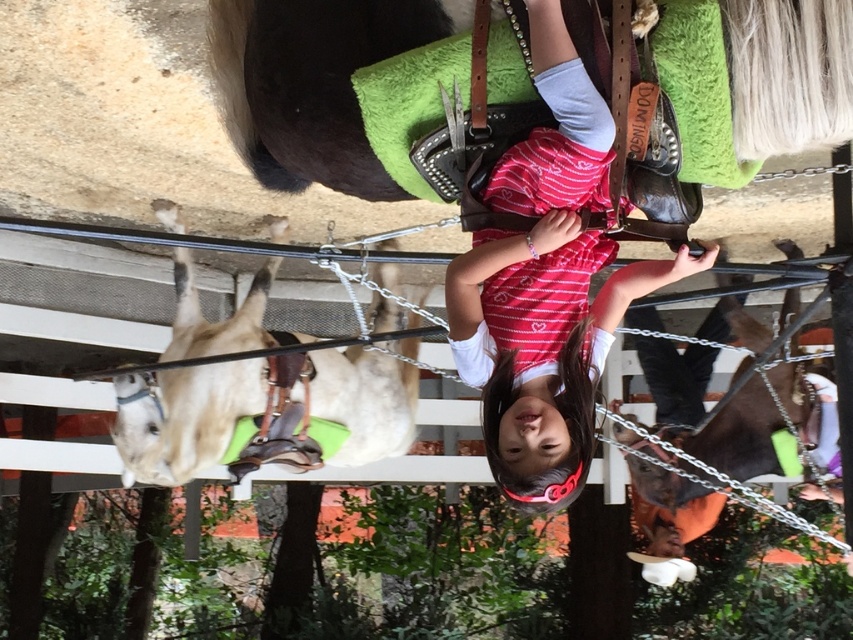
You are a photographer setting up for a portrait of the young girl and the horse. You have two markers placed at point (x=476, y=372) and point (x=177, y=262). Which marker is closer to your camera lens?

Point (x=476, y=372) is closer to the camera than point (x=177, y=262).

You are a photographer trying to capture a photo of the matte pink dress at center and the light brown leather horse at left. Based on their heights, which one should you focus on first if you want to ensure both are fully visible in the frame?

The matte pink dress at center is not as tall as the light brown leather horse at left, so you should focus on the light brown leather horse at left first to ensure it is fully visible in the frame before adjusting for the shorter matte pink dress at center.

You are a photographer trying to capture a group photo of the matte pink dress at center and the light brown leather horse at left. If you want to ensure both subjects are fully visible in the frame, which subject should you position closer to the camera to avoid cropping?

You should position the matte pink dress at center closer to the camera because it occupies less space than the light brown leather horse at left, so it can be moved forward without blocking the horse while ensuring both are fully visible.